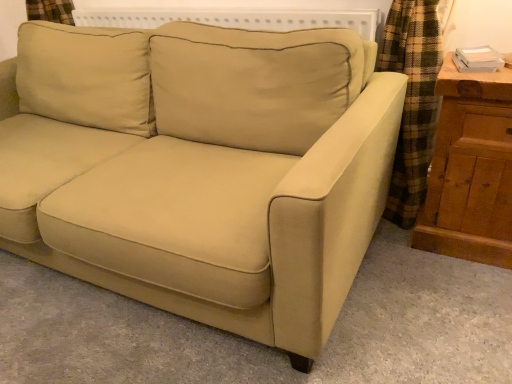
Question: In terms of width, does beige fabric couch at center look wider or thinner when compared to wooden dresser at right?

Choices:
 (A) thin
 (B) wide

Answer: (B)

Question: From their relative heights in the image, would you say beige fabric couch at center is taller or shorter than wooden dresser at right?

Choices:
 (A) short
 (B) tall

Answer: (B)

Question: Relative to wooden dresser at right, is beige fabric couch at center in front or behind?

Choices:
 (A) behind
 (B) front

Answer: (B)

Question: From the image's perspective, is wooden dresser at right positioned above or below beige fabric couch at center?

Choices:
 (A) above
 (B) below

Answer: (B)

Question: From a real-world perspective, is wooden dresser at right above or below beige fabric couch at center?

Choices:
 (A) above
 (B) below

Answer: (B)

Question: From their relative heights in the image, would you say wooden dresser at right is taller or shorter than beige fabric couch at center?

Choices:
 (A) short
 (B) tall

Answer: (A)

Question: Looking at their shapes, would you say wooden dresser at right is wider or thinner than beige fabric couch at center?

Choices:
 (A) thin
 (B) wide

Answer: (A)